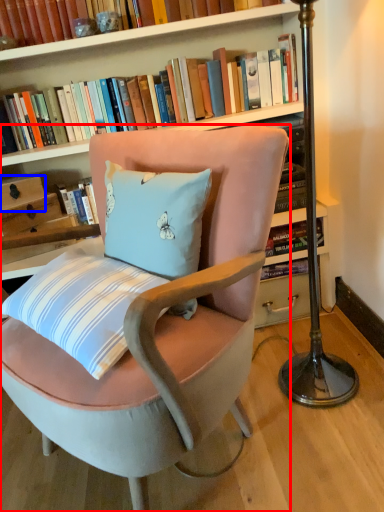
Question: Which point is further to the camera, chair (highlighted by a red box) or drawer (highlighted by a blue box)?

Choices:
 (A) chair
 (B) drawer

Answer: (B)